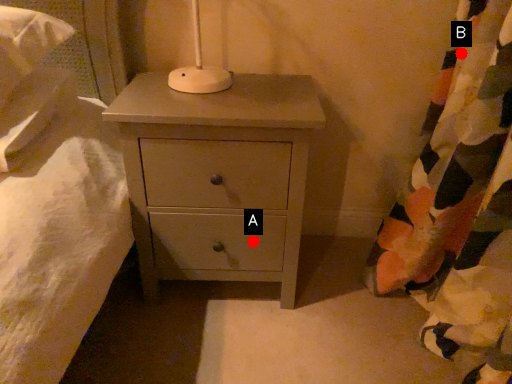
Question: Two points are circled on the image, labeled by A and B beside each circle. Which of the following is the closest to the observer?

Choices:
 (A) A is closer
 (B) B is closer

Answer: (B)